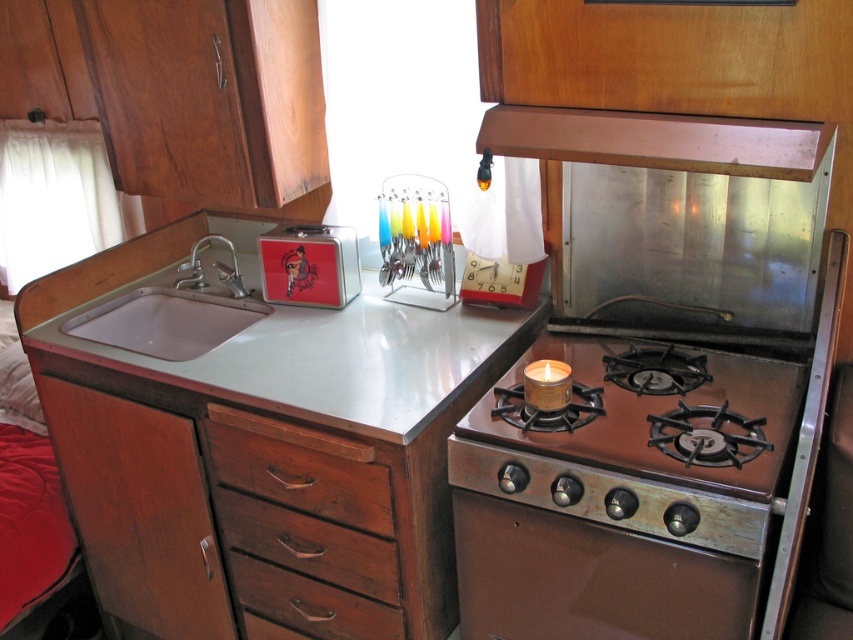
Question: Does brown metallic oven at center come behind white glossy sink at left?

Choices:
 (A) yes
 (B) no

Answer: (B)

Question: Which point appears closest to the camera in this image?

Choices:
 (A) (495, 625)
 (B) (70, 324)

Answer: (A)

Question: Can you confirm if wooden drawer at lower left is positioned to the left of translucent plastic spoon rack at center?

Choices:
 (A) no
 (B) yes

Answer: (B)

Question: Estimate the real-world distances between objects in this image. Which object is closer to the metallic silver exhaust hood at upper center?

Choices:
 (A) shiny metallic gas stove at right
 (B) white glossy sink at left

Answer: (A)

Question: Which is nearer to the metallic gray counter top at center?

Choices:
 (A) translucent plastic spoon rack at center
 (B) wooden drawer at lower left

Answer: (A)

Question: Does metallic silver exhaust hood at upper center come behind translucent plastic spoon rack at center?

Choices:
 (A) yes
 (B) no

Answer: (B)